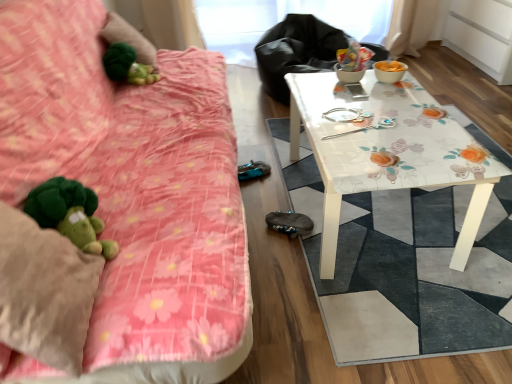
Question: Is floral glass table at center a part of green plush at upper left?

Choices:
 (A) yes
 (B) no

Answer: (B)

Question: Could you tell me if green plush at upper left is facing floral glass table at center?

Choices:
 (A) yes
 (B) no

Answer: (B)

Question: Can you confirm if green plush at upper left is positioned to the left of floral glass table at center?

Choices:
 (A) no
 (B) yes

Answer: (B)

Question: From a real-world perspective, is green plush at upper left on floral glass table at center?

Choices:
 (A) yes
 (B) no

Answer: (A)

Question: From the image's perspective, is green plush at upper left below floral glass table at center?

Choices:
 (A) no
 (B) yes

Answer: (A)

Question: Based on their sizes in the image, would you say floral-patterned table at right is bigger or smaller than green plush at upper left?

Choices:
 (A) big
 (B) small

Answer: (A)

Question: Considering the relative positions of floral-patterned table at right and green plush at upper left in the image provided, is floral-patterned table at right to the left or to the right of green plush at upper left?

Choices:
 (A) left
 (B) right

Answer: (B)

Question: Is floral-patterned table at right taller or shorter than green plush at upper left?

Choices:
 (A) short
 (B) tall

Answer: (B)

Question: Do you think floral-patterned table at right is within green plush at upper left, or outside of it?

Choices:
 (A) inside
 (B) outside

Answer: (B)

Question: In terms of width, does metallic silver spoon at center look wider or thinner when compared to green plush at upper left?

Choices:
 (A) thin
 (B) wide

Answer: (A)

Question: Relative to green plush at upper left, is metallic silver spoon at center in front or behind?

Choices:
 (A) front
 (B) behind

Answer: (A)

Question: From the image's perspective, is metallic silver spoon at center above or below green plush at upper left?

Choices:
 (A) above
 (B) below

Answer: (B)

Question: Looking at the image, does metallic silver spoon at center seem bigger or smaller compared to green plush at upper left?

Choices:
 (A) small
 (B) big

Answer: (A)

Question: Is green plush at upper left wider or thinner than floral glass table at center?

Choices:
 (A) thin
 (B) wide

Answer: (A)

Question: Would you say green plush at upper left is to the left or to the right of floral glass table at center in the picture?

Choices:
 (A) right
 (B) left

Answer: (B)